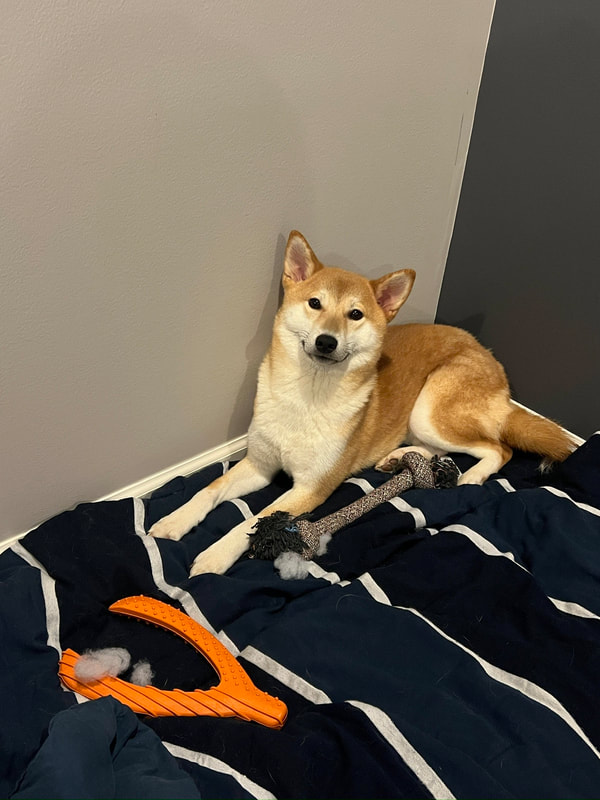
Locate an element on the screen. cream colored wall is located at coordinates pos(128,330).